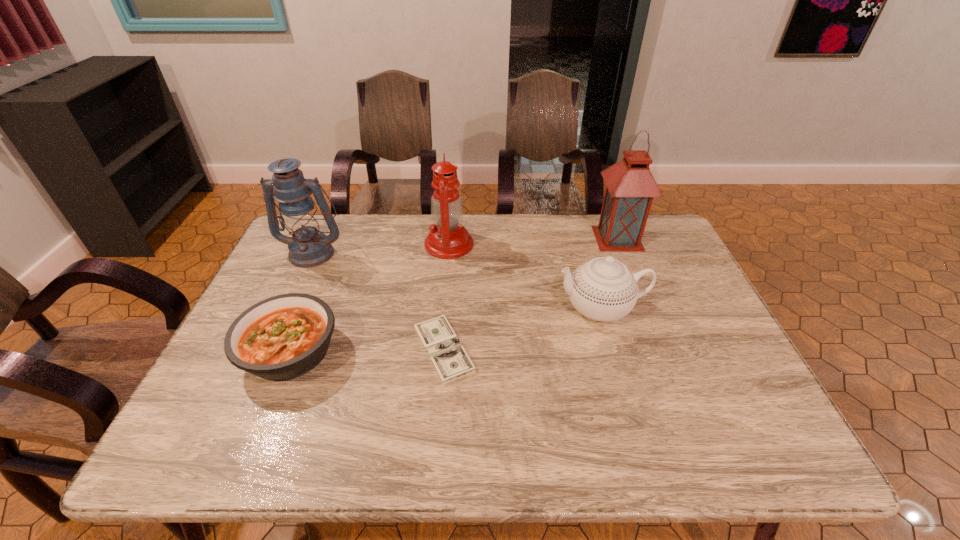
Find the location of a particular element. The image size is (960, 540). vacant space at the far edge of the desktop is located at coordinates (361, 229).

Where is `free spot at the near edge of the desktop`? free spot at the near edge of the desktop is located at coordinates click(478, 451).

The width and height of the screenshot is (960, 540). In the image, there is a desktop. In order to click on vacant space at the right edge in this screenshot , I will do `click(679, 311)`.

I want to click on vacant space at the far left corner of the desktop, so click(x=323, y=216).

This screenshot has height=540, width=960. In the image, there is a desktop. In order to click on vacant space at the near right corner in this screenshot , I will do `click(789, 447)`.

At what (x,y) coordinates should I click in order to perform the action: click on free spot between the dollar and the left lantern. Please return your answer as a coordinate pair (x, y). Looking at the image, I should click on (378, 301).

You are a GUI agent. You are given a task and a screenshot of the screen. Output one action in this format:
    pyautogui.click(x=<x>, y=<y>)
    Task: Click on the empty location between the shortest object and the stew
    
    Given the screenshot: What is the action you would take?
    pyautogui.click(x=367, y=350)

This screenshot has height=540, width=960. Find the location of `vacant area that lies between the oil lamp and the left lantern`. vacant area that lies between the oil lamp and the left lantern is located at coordinates (381, 248).

The image size is (960, 540). Find the location of `empty space that is in between the fifth tallest object and the shortest object`. empty space that is in between the fifth tallest object and the shortest object is located at coordinates (367, 350).

Locate an element on the screen. free spot between the left lantern and the dollar is located at coordinates (378, 301).